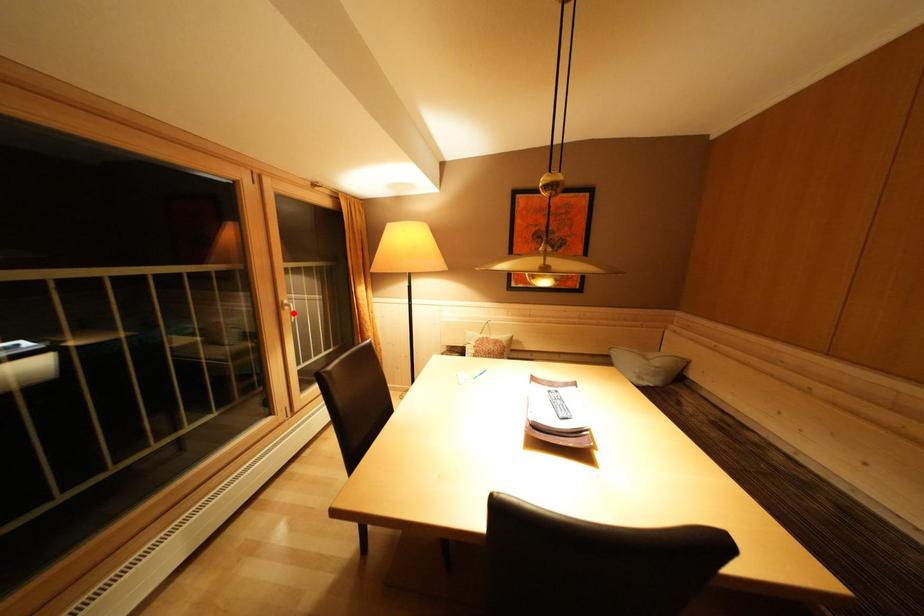
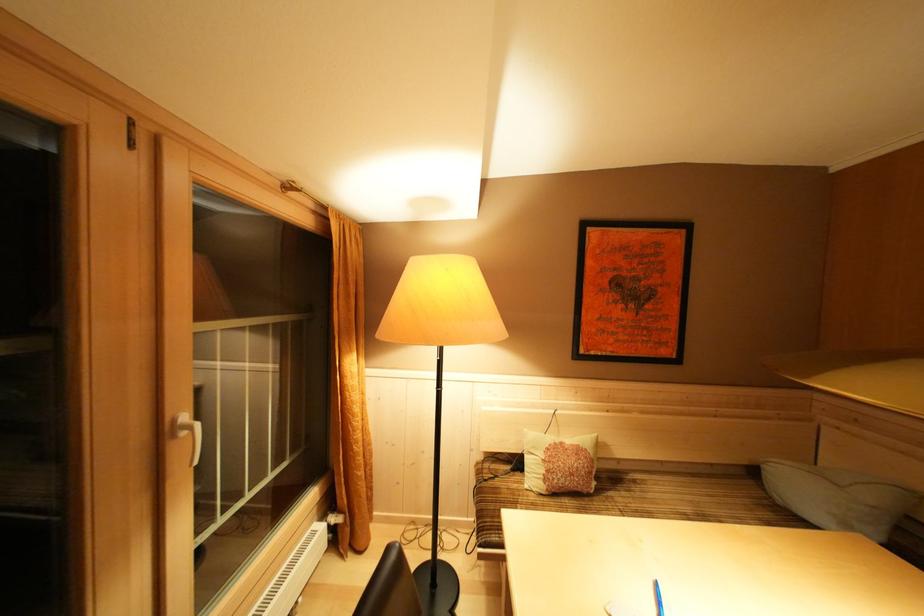
Find the pixel in the second image that matches the highlighted location in the first image.

(190, 438)